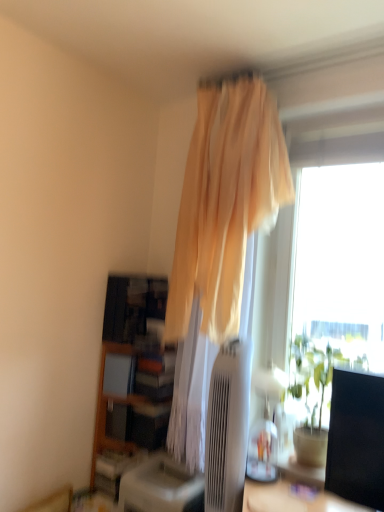
Question: Would you say satin beige air conditioner at center contains green leafy plant at right?

Choices:
 (A) no
 (B) yes

Answer: (A)

Question: Considering the relative positions of satin beige air conditioner at center and green leafy plant at right in the image provided, is satin beige air conditioner at center to the right of green leafy plant at right from the viewer's perspective?

Choices:
 (A) no
 (B) yes

Answer: (A)

Question: Considering the relative sizes of satin beige air conditioner at center and green leafy plant at right in the image provided, is satin beige air conditioner at center bigger than green leafy plant at right?

Choices:
 (A) yes
 (B) no

Answer: (B)

Question: From the image's perspective, is satin beige air conditioner at center above green leafy plant at right?

Choices:
 (A) yes
 (B) no

Answer: (B)

Question: Is satin beige air conditioner at center not close to green leafy plant at right?

Choices:
 (A) no
 (B) yes

Answer: (A)

Question: Is satin beige air conditioner at center positioned behind green leafy plant at right?

Choices:
 (A) yes
 (B) no

Answer: (B)

Question: Would you say green leafy plant at right is a long distance from satin beige air conditioner at center?

Choices:
 (A) no
 (B) yes

Answer: (A)

Question: Considering the relative positions of green leafy plant at right and satin beige air conditioner at center in the image provided, is green leafy plant at right to the right of satin beige air conditioner at center from the viewer's perspective?

Choices:
 (A) yes
 (B) no

Answer: (A)

Question: Could you tell me if green leafy plant at right is facing satin beige air conditioner at center?

Choices:
 (A) yes
 (B) no

Answer: (B)

Question: Is green leafy plant at right surrounding satin beige air conditioner at center?

Choices:
 (A) no
 (B) yes

Answer: (A)

Question: Considering the relative sizes of green leafy plant at right and satin beige air conditioner at center in the image provided, is green leafy plant at right smaller than satin beige air conditioner at center?

Choices:
 (A) no
 (B) yes

Answer: (A)

Question: Is green leafy plant at right looking in the opposite direction of satin beige air conditioner at center?

Choices:
 (A) no
 (B) yes

Answer: (A)

Question: From the image's perspective, is wooden bookshelf at lower left beneath beige sheer curtain at upper center?

Choices:
 (A) yes
 (B) no

Answer: (A)